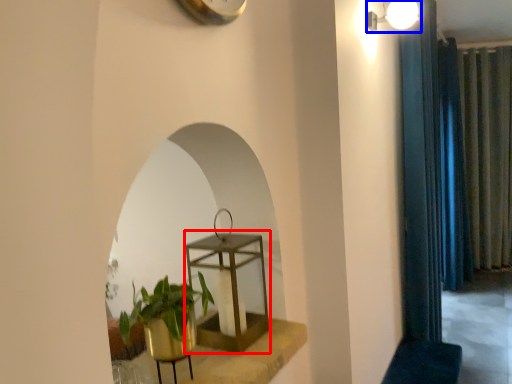
Question: Which object appears farthest to the camera in this image, round table (highlighted by a red box) or light fixture (highlighted by a blue box)?

Choices:
 (A) round table
 (B) light fixture

Answer: (B)